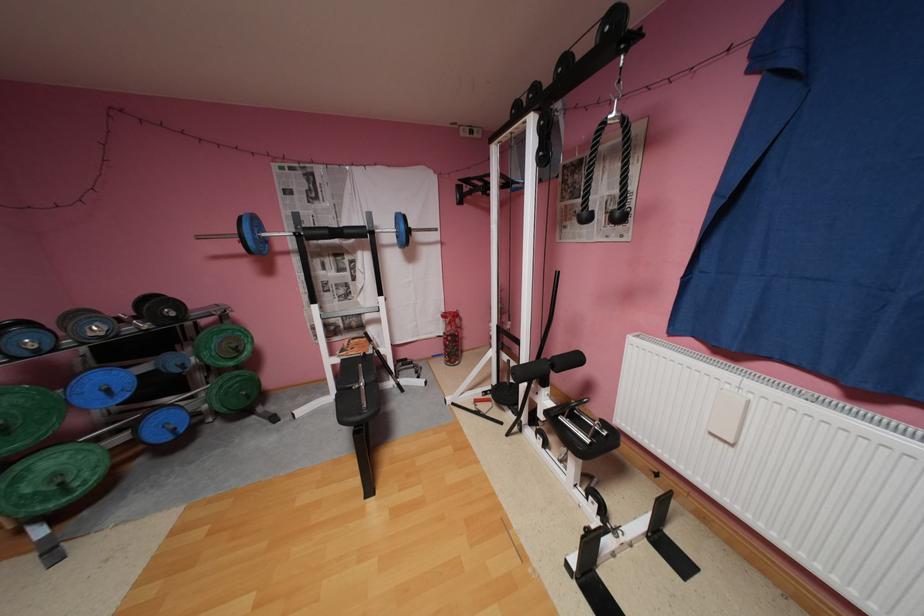
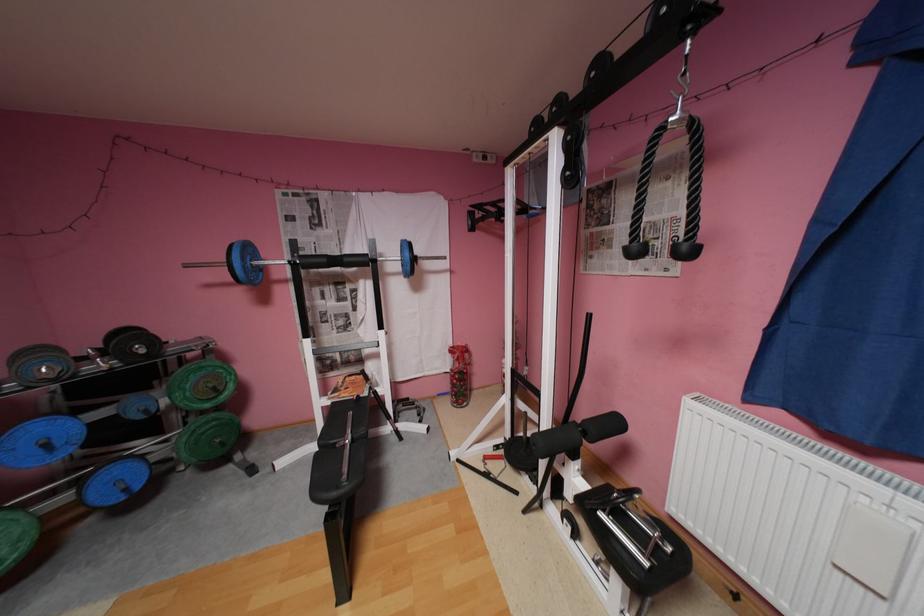
Where in the second image is the point corresponding to (116,391) from the first image?

(55, 445)